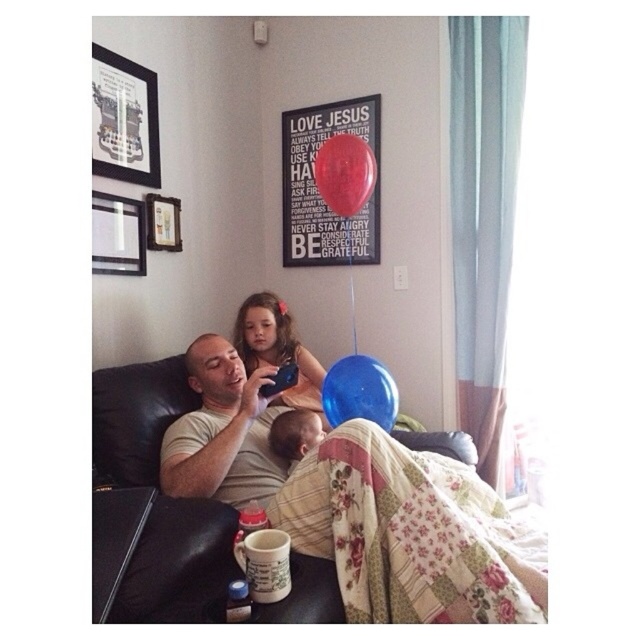
Can you confirm if matte white t-shirt at center is positioned below matte black picture frame at upper left?

Indeed, matte white t-shirt at center is positioned under matte black picture frame at upper left.

Image resolution: width=640 pixels, height=640 pixels. Find the location of `matte white t-shirt at center`. matte white t-shirt at center is located at coordinates (221, 432).

Who is more distant from viewer, (214, 451) or (108, 92)?

Point (108, 92)

Where is `matte white t-shirt at center`? matte white t-shirt at center is located at coordinates (221, 432).

Between metallic silver picture frame at upper left and shiny red balloon at upper center, which one appears on the left side from the viewer's perspective?

metallic silver picture frame at upper left is more to the left.

Can you confirm if metallic silver picture frame at upper left is positioned above shiny red balloon at upper center?

No.

Who is more forward, (125, 240) or (332, 202)?

Point (332, 202) is in front.

Locate an element on the screen. metallic silver picture frame at upper left is located at coordinates (116, 234).

Is point (272, 413) positioned in front of point (145, 250)?

Yes, it is.

Which of these two, matte white t-shirt at center or metallic silver picture frame at upper left, stands taller?

With more height is matte white t-shirt at center.

Is point (177, 428) farther from viewer compared to point (93, 253)?

No, it is in front of (93, 253).

Find the location of a particular element. The width and height of the screenshot is (640, 640). matte white t-shirt at center is located at coordinates (221, 432).